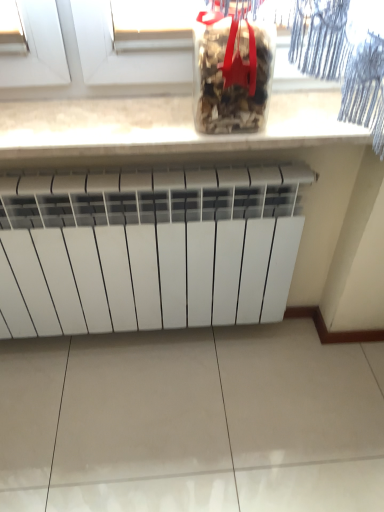
Locate an element on the screen. The image size is (384, 512). white stone countertop at upper center is located at coordinates (164, 126).

You are a GUI agent. You are given a task and a screenshot of the screen. Output one action in this format:
    pyautogui.click(x=<x>, y=<y>)
    Task: Click on the transparent plastic container at upper center
    
    Given the screenshot: What is the action you would take?
    coord(232,68)

The width and height of the screenshot is (384, 512). I want to click on white matte radiator at center, so click(148, 249).

Is point (156, 118) less distant than point (251, 58)?

No, (156, 118) is further to viewer.

Would you say white stone countertop at upper center is a long distance from transparent plastic container at upper center?

That's not correct — white stone countertop at upper center is a little close to transparent plastic container at upper center.

Between white stone countertop at upper center and transparent plastic container at upper center, which one appears on the left side from the viewer's perspective?

white stone countertop at upper center is more to the left.

Does white stone countertop at upper center turn towards transparent plastic container at upper center?

No, white stone countertop at upper center is not aimed at transparent plastic container at upper center.

Is white matte radiator at center far away from transparent plastic container at upper center?

No, white matte radiator at center is not far from transparent plastic container at upper center.

Is white matte radiator at center taller than transparent plastic container at upper center?

Yes, white matte radiator at center is taller than transparent plastic container at upper center.

The width and height of the screenshot is (384, 512). I want to click on wine bottle that is in front of the white matte radiator at center, so click(232, 68).

From a real-world perspective, who is located higher, white matte radiator at center or transparent plastic container at upper center?

Result: transparent plastic container at upper center is physically above.

In terms of width, does transparent plastic container at upper center look wider or thinner when compared to white matte radiator at center?

transparent plastic container at upper center is thinner than white matte radiator at center.

From the image's perspective, relative to white matte radiator at center, is transparent plastic container at upper center above or below?

From the image's perspective, transparent plastic container at upper center appears above white matte radiator at center.

Is the position of transparent plastic container at upper center more distant than that of white matte radiator at center?

No.

How many degrees apart are the facing directions of white matte radiator at center and white stone countertop at upper center?

0.546 degrees separate the facing orientations of white matte radiator at center and white stone countertop at upper center.

Which is closer to the camera, (292,209) or (46,150)?

Point (292,209) is farther from the camera than point (46,150).

From the image's perspective, between white matte radiator at center and white stone countertop at upper center, who is located below?

From the image's view, white matte radiator at center is below.

In terms of size, does white matte radiator at center appear bigger or smaller than white stone countertop at upper center?

Clearly, white matte radiator at center is larger in size than white stone countertop at upper center.

Can you confirm if white stone countertop at upper center is taller than white matte radiator at center?

Incorrect, the height of white stone countertop at upper center is not larger of that of white matte radiator at center.

Which object is closer to the camera taking this photo, white stone countertop at upper center or white matte radiator at center?

white stone countertop at upper center.

What are the coordinates of `countertop on the right of white matte radiator at center` in the screenshot? It's located at (164, 126).

Who is smaller, transparent plastic container at upper center or white stone countertop at upper center?

transparent plastic container at upper center is smaller.

Which object is positioned more to the right, transparent plastic container at upper center or white stone countertop at upper center?

transparent plastic container at upper center is more to the right.

Is transparent plastic container at upper center surrounding white stone countertop at upper center?

No, transparent plastic container at upper center does not contain white stone countertop at upper center.

From a real-world perspective, is transparent plastic container at upper center beneath white stone countertop at upper center?

No, from a real-world perspective, transparent plastic container at upper center is not under white stone countertop at upper center.

Find the location of a particular element. countertop below the transparent plastic container at upper center (from a real-world perspective) is located at coordinates (164, 126).

Image resolution: width=384 pixels, height=512 pixels. In order to click on radiator lying on the left of transparent plastic container at upper center in this screenshot , I will do pyautogui.click(x=148, y=249).

Based on their spatial positions, is white matte radiator at center or white stone countertop at upper center further from transparent plastic container at upper center?

Among the two, white matte radiator at center is located further to transparent plastic container at upper center.

Which object lies further to the anchor point transparent plastic container at upper center, white stone countertop at upper center or white matte radiator at center?

Among the two, white matte radiator at center is located further to transparent plastic container at upper center.

Based on their spatial positions, is white matte radiator at center or transparent plastic container at upper center closer to white stone countertop at upper center?

transparent plastic container at upper center lies closer to white stone countertop at upper center than the other object.

From the image, which object appears to be nearer to white matte radiator at center, transparent plastic container at upper center or white stone countertop at upper center?

Based on the image, white stone countertop at upper center appears to be nearer to white matte radiator at center.

Which object lies nearer to the anchor point white stone countertop at upper center, transparent plastic container at upper center or white matte radiator at center?

transparent plastic container at upper center lies closer to white stone countertop at upper center than the other object.

Based on their spatial positions, is white stone countertop at upper center or transparent plastic container at upper center further from white matte radiator at center?

Among the two, transparent plastic container at upper center is located further to white matte radiator at center.

You are a GUI agent. You are given a task and a screenshot of the screen. Output one action in this format:
    pyautogui.click(x=<x>, y=<y>)
    Task: Click on the countertop between transparent plastic container at upper center and white matte radiator at center from top to bottom
    This screenshot has width=384, height=512.
    Given the screenshot: What is the action you would take?
    pyautogui.click(x=164, y=126)